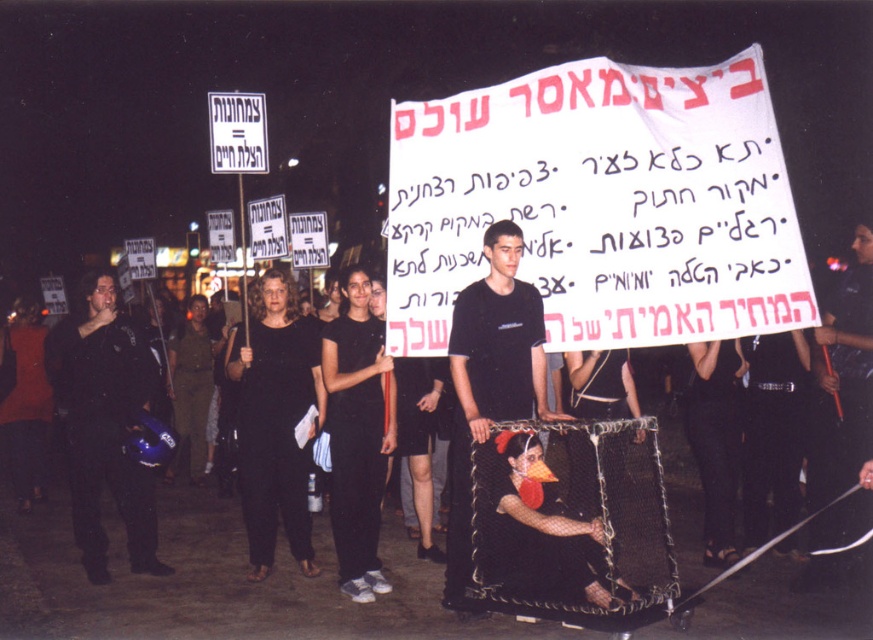
Question: Which of the following is the farthest from the observer?

Choices:
 (A) black matte shirt at center
 (B) black matte helmet at left

Answer: (B)

Question: In this image, where is black matte helmet at left located relative to black matte shirt at center?

Choices:
 (A) below
 (B) above

Answer: (A)

Question: In this image, where is black matte helmet at left located relative to black matte shirt at center?

Choices:
 (A) below
 (B) above

Answer: (A)

Question: Which point is farther to the camera?

Choices:
 (A) (445, 541)
 (B) (124, 324)

Answer: (B)

Question: Where is black matte helmet at left located in relation to black matte shirt at center in the image?

Choices:
 (A) left
 (B) right

Answer: (A)